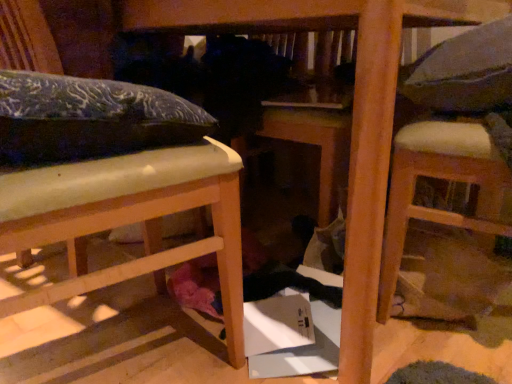
Question: Is matte blue pillow at upper left not near white padded chair at right, marked as the 1th furniture in a right-to-left arrangement?

Choices:
 (A) no
 (B) yes

Answer: (A)

Question: Is matte blue pillow at upper left surrounding white padded chair at right, the 2th furniture viewed from the left?

Choices:
 (A) no
 (B) yes

Answer: (A)

Question: Can you confirm if matte blue pillow at upper left is smaller than white padded chair at right, the 2th furniture viewed from the left?

Choices:
 (A) no
 (B) yes

Answer: (B)

Question: Is white padded chair at right, the 2th furniture viewed from the left, at the back of matte blue pillow at upper left?

Choices:
 (A) yes
 (B) no

Answer: (B)

Question: Is matte blue pillow at upper left thinner than white padded chair at right, marked as the 1th furniture in a right-to-left arrangement?

Choices:
 (A) no
 (B) yes

Answer: (A)

Question: Is matte wood bed at left, the first furniture positioned from the left, inside the boundaries of matte blue pillow at upper left, or outside?

Choices:
 (A) inside
 (B) outside

Answer: (B)

Question: Is matte wood bed at left, the 2th furniture when ordered from right to left, wider or thinner than matte blue pillow at upper left?

Choices:
 (A) wide
 (B) thin

Answer: (A)

Question: Would you say matte wood bed at left, the first furniture positioned from the left, is to the left or to the right of matte blue pillow at upper left in the picture?

Choices:
 (A) right
 (B) left

Answer: (B)

Question: From their relative heights in the image, would you say matte wood bed at left, the first furniture positioned from the left, is taller or shorter than matte blue pillow at upper left?

Choices:
 (A) short
 (B) tall

Answer: (B)

Question: Is white padded chair at right, marked as the 1th furniture in a right-to-left arrangement, wider or thinner than matte wood bed at left, the first furniture positioned from the left?

Choices:
 (A) wide
 (B) thin

Answer: (B)

Question: Is white padded chair at right, the 2th furniture viewed from the left, bigger or smaller than matte wood bed at left, the first furniture positioned from the left?

Choices:
 (A) small
 (B) big

Answer: (A)

Question: From their relative heights in the image, would you say white padded chair at right, marked as the 1th furniture in a right-to-left arrangement, is taller or shorter than matte wood bed at left, the first furniture positioned from the left?

Choices:
 (A) short
 (B) tall

Answer: (B)

Question: Is white padded chair at right, the 2th furniture viewed from the left, situated inside matte wood bed at left, the first furniture positioned from the left, or outside?

Choices:
 (A) inside
 (B) outside

Answer: (B)

Question: Based on their sizes in the image, would you say matte blue pillow at upper left is bigger or smaller than gray fabric pillow at upper right?

Choices:
 (A) big
 (B) small

Answer: (B)

Question: Is matte blue pillow at upper left in front of or behind gray fabric pillow at upper right in the image?

Choices:
 (A) behind
 (B) front

Answer: (B)